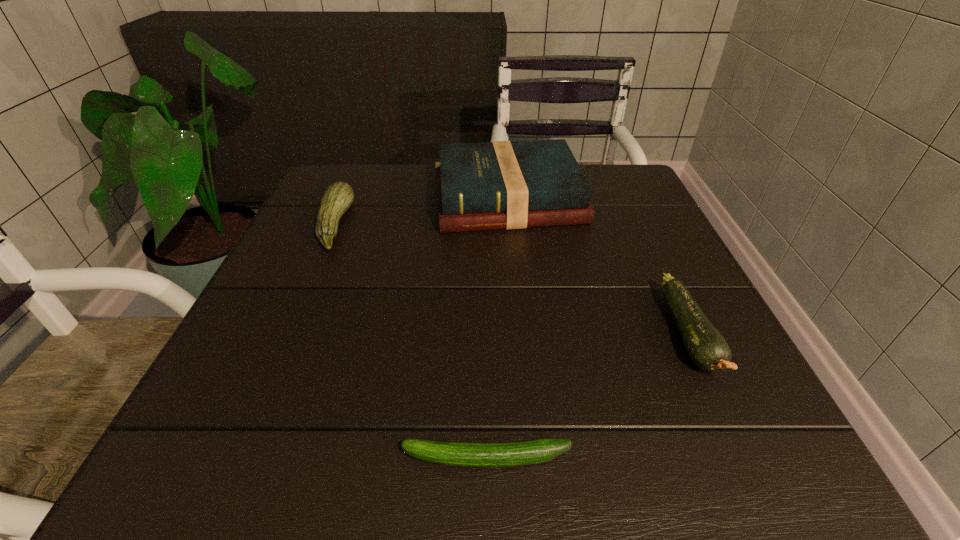
Where is `zucchini that can be found as the closest to the second zucchini from left to right`? zucchini that can be found as the closest to the second zucchini from left to right is located at coordinates (707, 348).

Select which zucchini is the closest to the tallest object. Please provide its 2D coordinates. Your answer should be formatted as a tuple, i.e. [(x, y)], where the tuple contains the x and y coordinates of a point satisfying the conditions above.

[(338, 197)]

You are a GUI agent. You are given a task and a screenshot of the screen. Output one action in this format:
    pyautogui.click(x=<x>, y=<y>)
    Task: Click on the vacant space that satisfies the following two spatial constraints: 1. on the front side of the hardback book; 2. on the front-facing side of the shortest zucchini
    The image size is (960, 540).
    Given the screenshot: What is the action you would take?
    pyautogui.click(x=532, y=458)

This screenshot has width=960, height=540. I want to click on vacant space that satisfies the following two spatial constraints: 1. at the blossom end of the rightmost zucchini; 2. on the front-facing side of the shortest zucchini, so click(x=748, y=458).

The width and height of the screenshot is (960, 540). Identify the location of free location that satisfies the following two spatial constraints: 1. at the blossom end of the second farthest zucchini; 2. on the front-facing side of the nearest zucchini. (748, 458).

Find the location of a particular element. The height and width of the screenshot is (540, 960). vacant space that satisfies the following two spatial constraints: 1. at the blossom end of the rightmost object; 2. on the front-facing side of the nearest object is located at coordinates (748, 458).